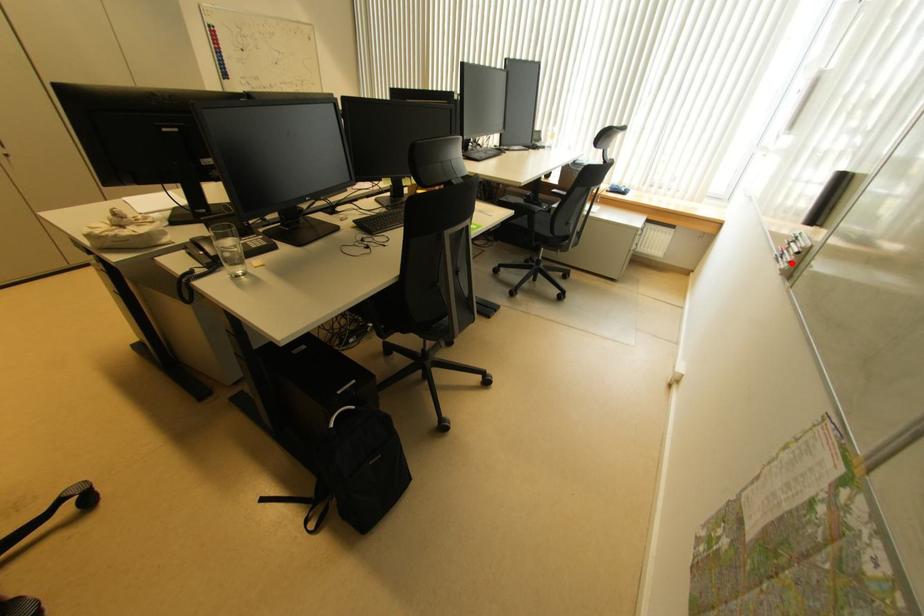
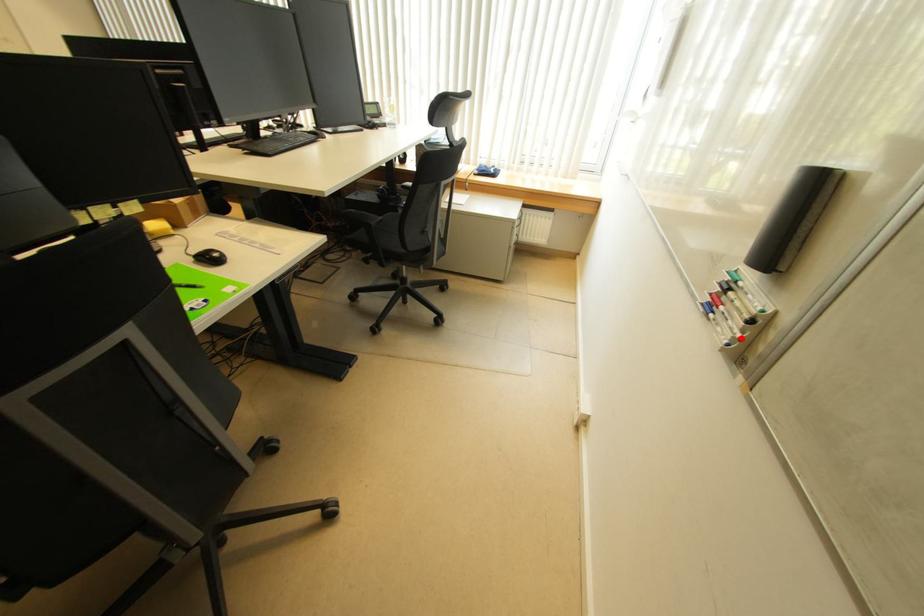
In the scene shown: I am providing you with two images of the same scene from different viewpoints. A red point is marked on the first image and another point is marked on the second image. Are the points marked in image1 and image2 representing the same 3D position?

Yes